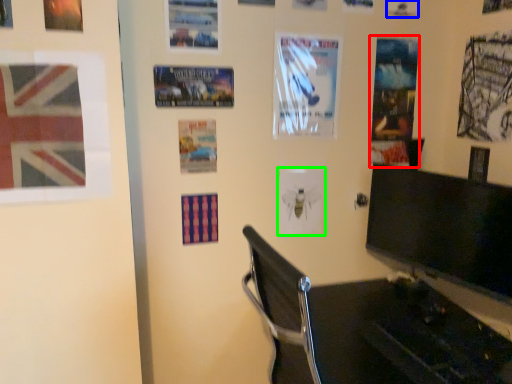
Question: Which object is the closest to the poster page (highlighted by a red box)? Choose among these: poster page (highlighted by a blue box) or poster (highlighted by a green box).

Choices:
 (A) poster page
 (B) poster

Answer: (A)